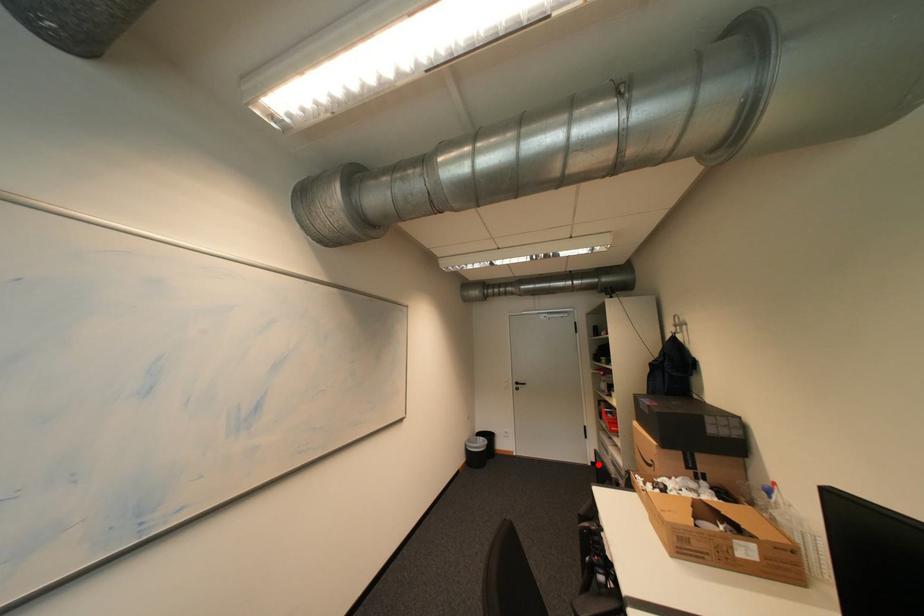
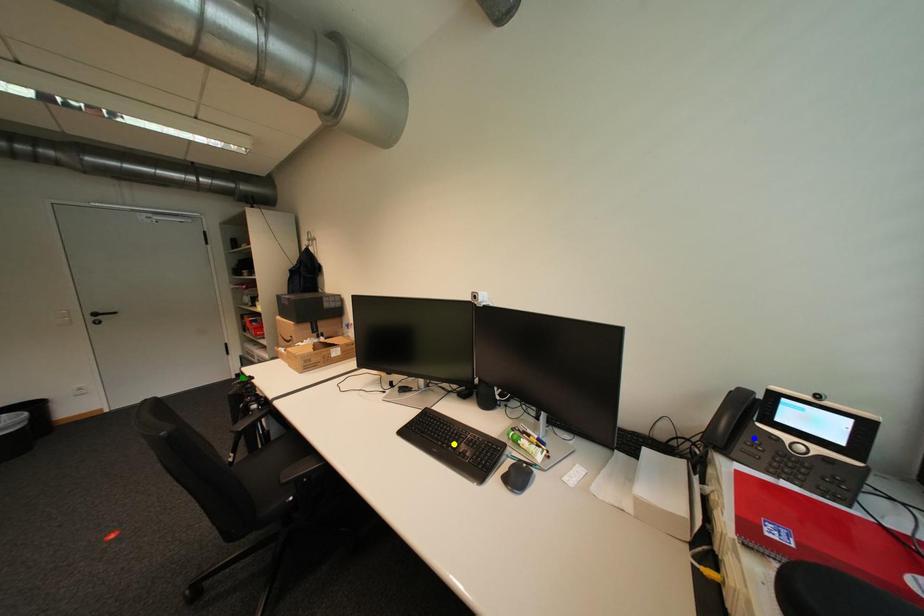
Question: I am providing you with two images of the same scene from different viewpoints. A red point is marked on the first image. You are given multiple points on the second image. Which point in image 2 represents the same 3d spot as the red point in image 1?

Choices:
 (A) green point
 (B) blue point
 (C) yellow point

Answer: (A)